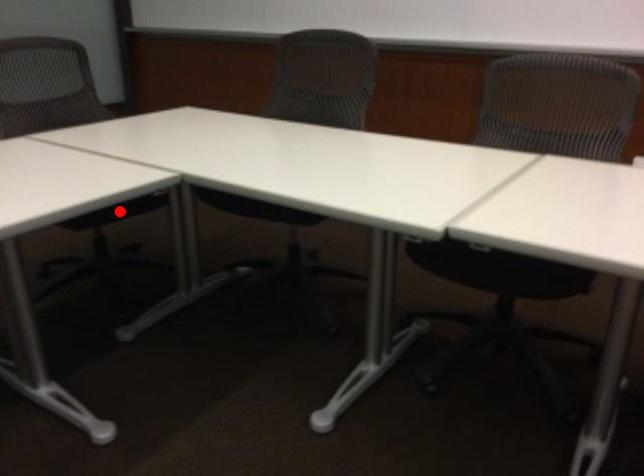
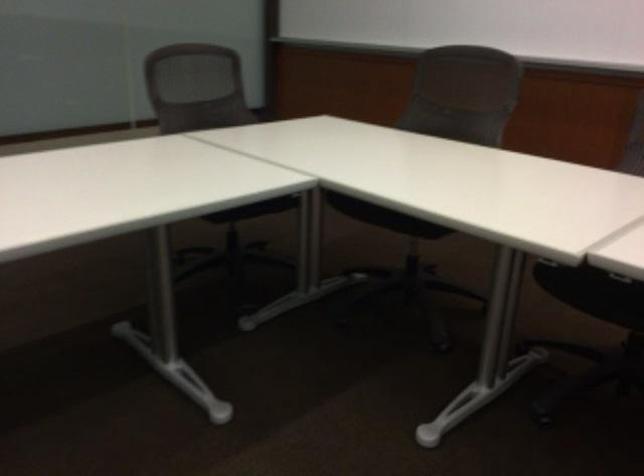
Question: I am providing you with two images of the same scene from different viewpoints. A red point is marked on the first image. At the location where the point appears in image 1, is it still visible in image 2?

Choices:
 (A) Yes
 (B) No

Answer: (A)